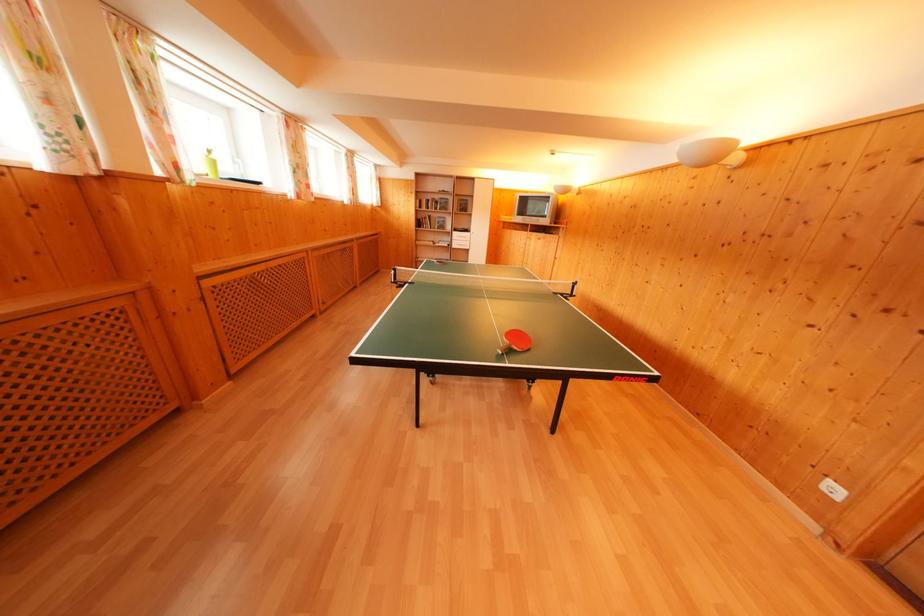
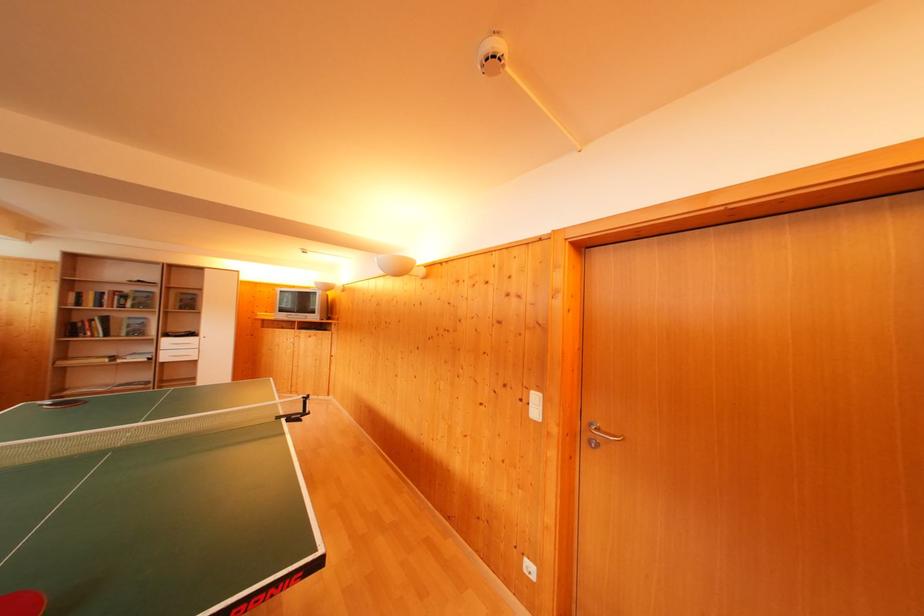
In the second image, find the point that corresponds to [445,229] in the first image.

(140, 331)